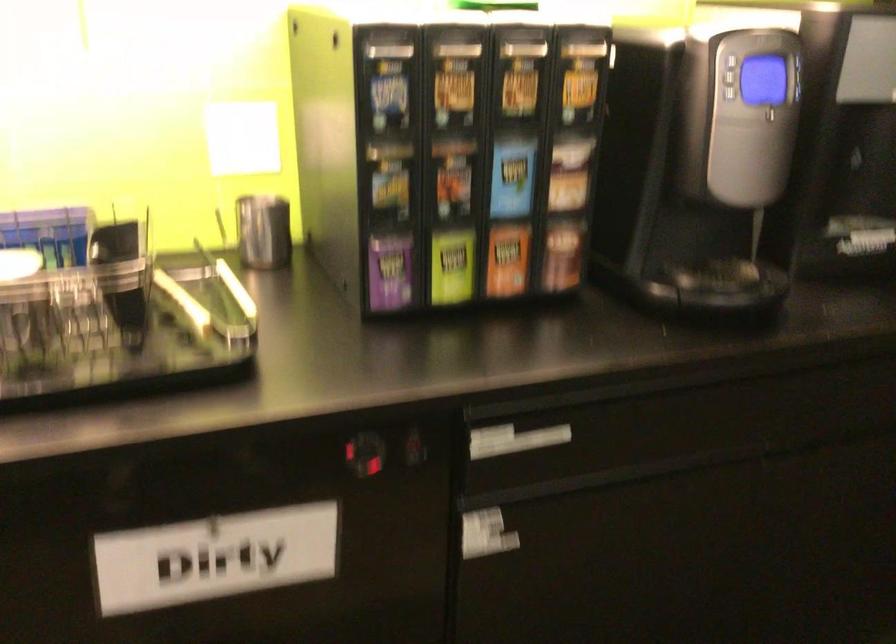
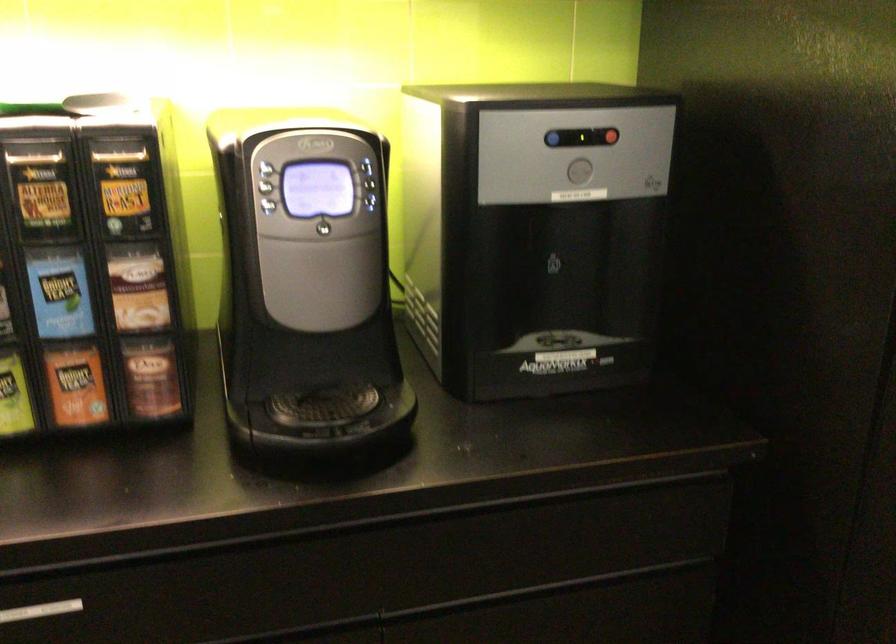
Where in the second image is the point corresponding to point (571, 169) from the first image?

(138, 287)